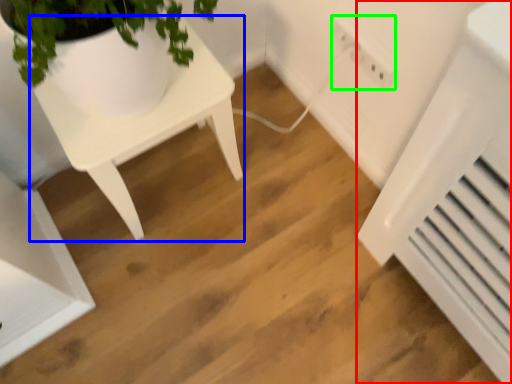
Question: Based on their relative distances, which object is farther from air conditioning (highlighted by a red box)? Choose from table (highlighted by a blue box) and electric outlet (highlighted by a green box).

Choices:
 (A) table
 (B) electric outlet

Answer: (A)